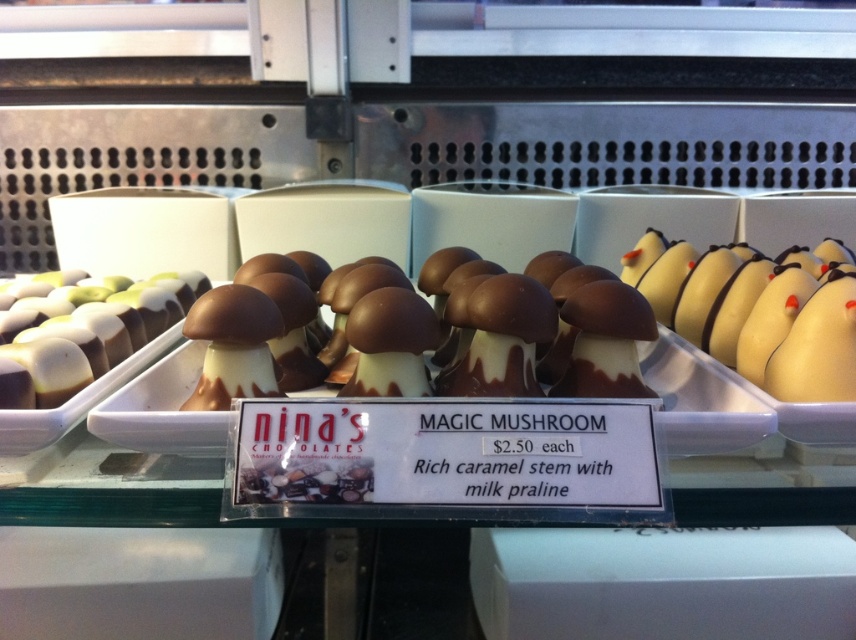
Between chocolate-coated mushroom at center and white glossy chocolate at left, which one has more height?

With more height is white glossy chocolate at left.

Between point (593, 369) and point (9, 314), which one is positioned in front?

Point (593, 369) is more forward.

The height and width of the screenshot is (640, 856). In order to click on chocolate-coated mushroom at center in this screenshot , I will do `click(550, 339)`.

What do you see at coordinates (764, 321) in the screenshot? I see `white chocolate with red accents at center` at bounding box center [764, 321].

Who is shorter, white chocolate with red accents at center or chocolate-coated mushroom at center?

chocolate-coated mushroom at center is shorter.

Find the location of a particular element. This screenshot has height=640, width=856. white chocolate with red accents at center is located at coordinates (764, 321).

Is white chocolate with red accents at center closer to the viewer compared to white glossy chocolate at left?

No, white chocolate with red accents at center is further to the viewer.

Is point (710, 275) positioned behind point (21, 358)?

Yes, point (710, 275) is behind point (21, 358).

Identify the location of white chocolate with red accents at center. The width and height of the screenshot is (856, 640). (764, 321).